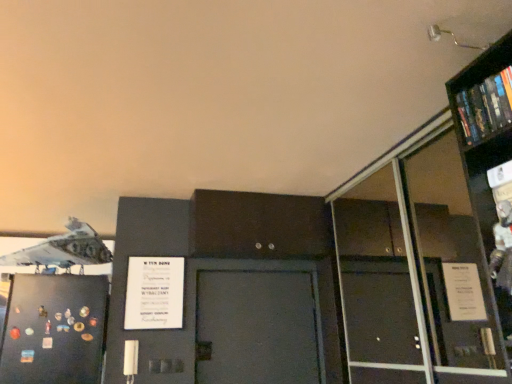
Question: From a real-world perspective, is hardcover book at upper right located higher than black matte refrigerator at left?

Choices:
 (A) no
 (B) yes

Answer: (B)

Question: Does hardcover book at upper right turn towards black matte refrigerator at left?

Choices:
 (A) yes
 (B) no

Answer: (B)

Question: Is hardcover book at upper right positioned beyond the bounds of black matte refrigerator at left?

Choices:
 (A) yes
 (B) no

Answer: (A)

Question: Is hardcover book at upper right thinner than black matte refrigerator at left?

Choices:
 (A) yes
 (B) no

Answer: (A)

Question: From the image's perspective, is hardcover book at upper right over black matte refrigerator at left?

Choices:
 (A) yes
 (B) no

Answer: (A)

Question: Considering the relative sizes of hardcover book at upper right and black matte refrigerator at left in the image provided, is hardcover book at upper right bigger than black matte refrigerator at left?

Choices:
 (A) no
 (B) yes

Answer: (A)

Question: Does black matte refrigerator at left have a larger size compared to hardcover book at upper right?

Choices:
 (A) yes
 (B) no

Answer: (A)

Question: From a real-world perspective, is black matte refrigerator at left located beneath hardcover book at upper right?

Choices:
 (A) no
 (B) yes

Answer: (B)

Question: Does black matte refrigerator at left have a greater height compared to hardcover book at upper right?

Choices:
 (A) no
 (B) yes

Answer: (B)

Question: Does black matte refrigerator at left have a lesser width compared to hardcover book at upper right?

Choices:
 (A) no
 (B) yes

Answer: (A)

Question: Is black matte refrigerator at left at the left side of hardcover book at upper right?

Choices:
 (A) yes
 (B) no

Answer: (A)

Question: Is black matte refrigerator at left turned away from hardcover book at upper right?

Choices:
 (A) yes
 (B) no

Answer: (B)

Question: Are white matte airplane at upper left and hardcover book at upper right far apart?

Choices:
 (A) yes
 (B) no

Answer: (A)